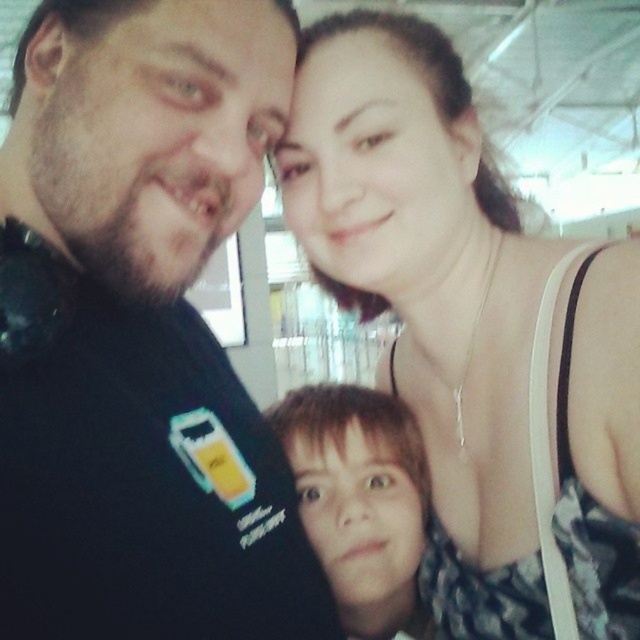
You are a photographer trying to capture a group photo of the black matte shirt at upper left and the matte black tank top at upper right. Given their current positions, which one should you focus on first to ensure they are both in frame?

The black matte shirt at upper left occupies less space than the matte black tank top at upper right, so you should focus on the matte black tank top at upper right first to ensure both fit within the frame.

You are taking a photo of the black matte shirt at upper left and the matte black tank top at upper right. Which of the two clothing items is wider?

The matte black tank top at upper right is wider than the black matte shirt at upper left.